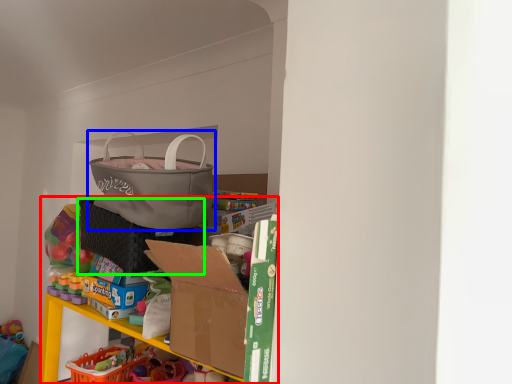
Question: Which object is positioned closest to bookshelf (highlighted by a red box)? Select from handbag (highlighted by a blue box) and laundry basket (highlighted by a green box).

Choices:
 (A) handbag
 (B) laundry basket

Answer: (B)